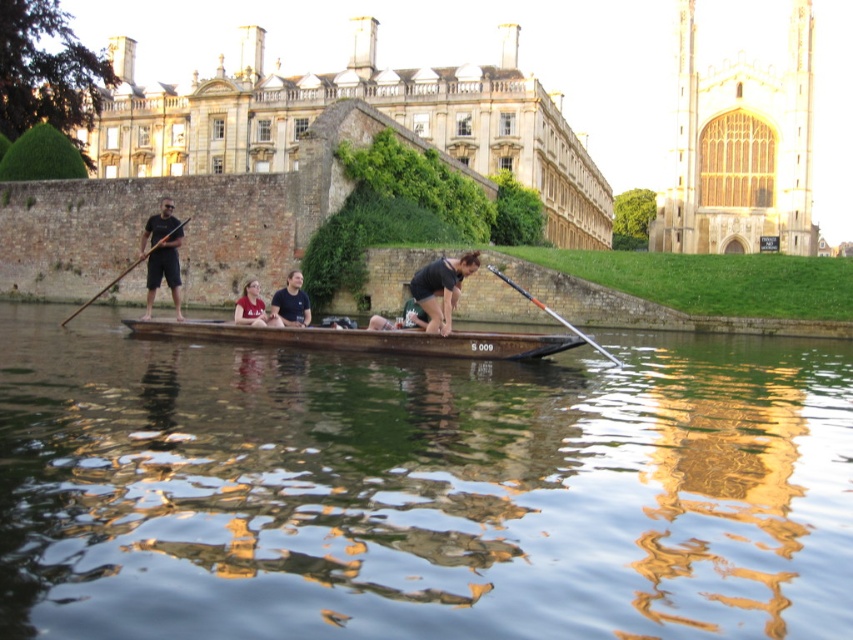
Question: Does brown wooden boat at center appear on the left side of matte red shirt at center?

Choices:
 (A) no
 (B) yes

Answer: (A)

Question: Is dark gray fabric shirt at center smaller than matte black paddle at left?

Choices:
 (A) no
 (B) yes

Answer: (B)

Question: Which point is closer to the camera taking this photo?

Choices:
 (A) (170, 269)
 (B) (505, 278)
 (C) (247, 314)
 (D) (426, 275)

Answer: (D)

Question: Can you confirm if matte black paddle at left is bigger than matte red shirt at center?

Choices:
 (A) no
 (B) yes

Answer: (B)

Question: Which point is farther to the camera?

Choices:
 (A) dark gray fabric shirt at center
 (B) brown wooden boat at center
 (C) wooden paddle at left

Answer: (C)

Question: Which object is positioned farthest from the orange fiberglass paddle at center?

Choices:
 (A) matte black paddle at left
 (B) stone building at upper center
 (C) wooden paddle at left
 (D) brown wooden canoe at center

Answer: (B)